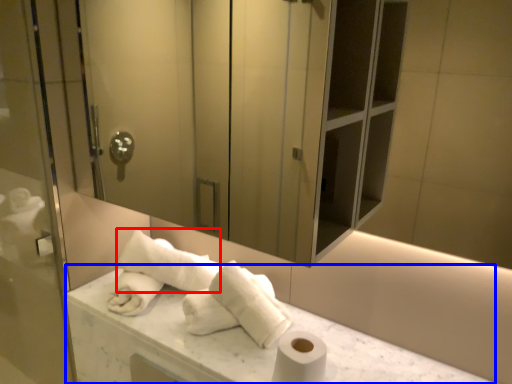
Question: Among these objects, which one is nearest to the camera, bath towel (highlighted by a red box) or counter top (highlighted by a blue box)?

Choices:
 (A) bath towel
 (B) counter top

Answer: (B)